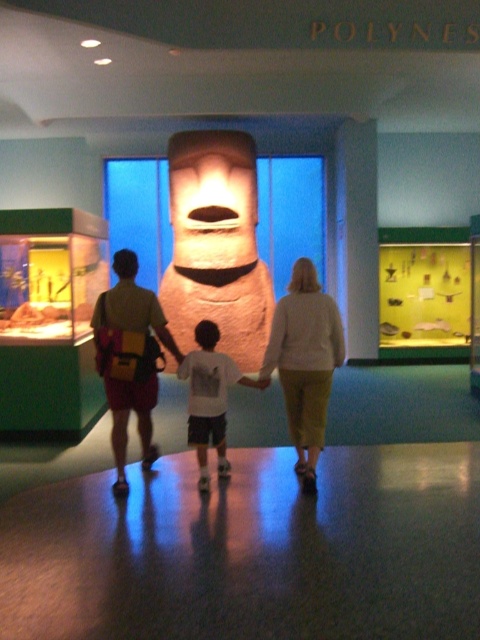
Does light beige sweater at center appear on the left side of white cotton shirt at center?

No, light beige sweater at center is not to the left of white cotton shirt at center.

The width and height of the screenshot is (480, 640). What do you see at coordinates (304, 362) in the screenshot? I see `light beige sweater at center` at bounding box center [304, 362].

I want to click on light beige sweater at center, so click(x=304, y=362).

Can you confirm if matte stone statue at center is positioned to the left of light beige sweater at center?

Correct, you'll find matte stone statue at center to the left of light beige sweater at center.

Which is in front, point (153, 385) or point (289, 380)?

Point (289, 380) is in front.

Which is behind, point (304, 362) or point (290, 348)?

Positioned behind is point (290, 348).

Identify the location of matte stone statue at center. The height and width of the screenshot is (640, 480). (279, 369).

Is point (116, 378) more distant than point (308, 436)?

No, (116, 378) is closer to viewer.

Image resolution: width=480 pixels, height=640 pixels. What do you see at coordinates (130, 358) in the screenshot?
I see `yellow backpack at center` at bounding box center [130, 358].

This screenshot has height=640, width=480. I want to click on yellow backpack at center, so click(130, 358).